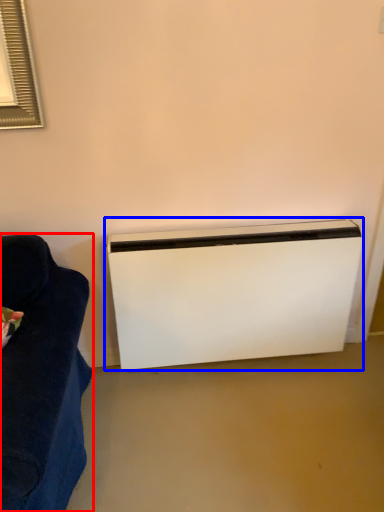
Question: Which of the following is the closest to the observer, furniture (highlighted by a red box) or home appliance (highlighted by a blue box)?

Choices:
 (A) furniture
 (B) home appliance

Answer: (A)